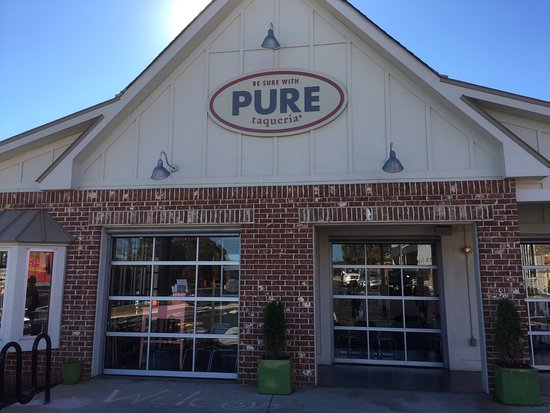
Image resolution: width=550 pixels, height=413 pixels. In order to click on window in this screenshot , I will do `click(166, 339)`, `click(397, 335)`, `click(41, 307)`, `click(539, 316)`.